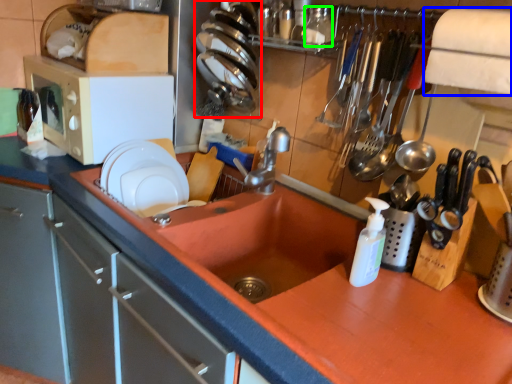
Question: Estimate the real-world distances between objects in this image. Which object is closer to tableware (highlighted by a red box), exhaust hood (highlighted by a blue box) or bottle (highlighted by a green box)?

Choices:
 (A) exhaust hood
 (B) bottle

Answer: (B)